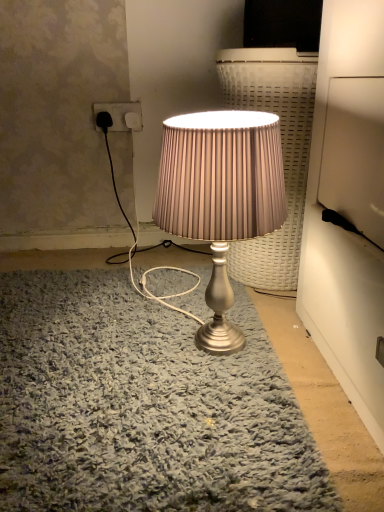
Question: Based on their positions, is satin silver lamp at center located to the left or right of matte white socket at upper left?

Choices:
 (A) left
 (B) right

Answer: (B)

Question: Is satin silver lamp at center inside the boundaries of matte white socket at upper left, or outside?

Choices:
 (A) inside
 (B) outside

Answer: (B)

Question: Is point (206, 188) closer or farther from the camera than point (117, 117)?

Choices:
 (A) closer
 (B) farther

Answer: (A)

Question: Is matte white socket at upper left in front of or behind satin silver lamp at center in the image?

Choices:
 (A) behind
 (B) front

Answer: (A)

Question: Based on their sizes in the image, would you say matte white socket at upper left is bigger or smaller than satin silver lamp at center?

Choices:
 (A) big
 (B) small

Answer: (B)

Question: In terms of width, does matte white socket at upper left look wider or thinner when compared to satin silver lamp at center?

Choices:
 (A) wide
 (B) thin

Answer: (B)

Question: Is matte white socket at upper left to the left or to the right of satin silver lamp at center in the image?

Choices:
 (A) left
 (B) right

Answer: (A)